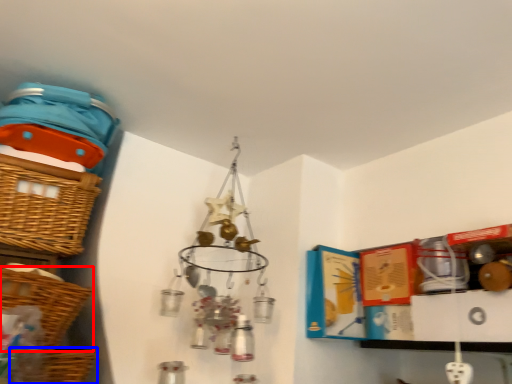
Question: Which of the following is the closest to the observer, basket (highlighted by a red box) or basket (highlighted by a blue box)?

Choices:
 (A) basket
 (B) basket

Answer: (A)